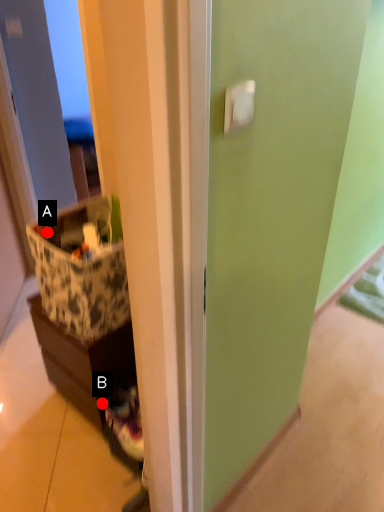
Question: Two points are circled on the image, labeled by A and B beside each circle. Which point appears closest to the camera in this image?

Choices:
 (A) A is closer
 (B) B is closer

Answer: (A)